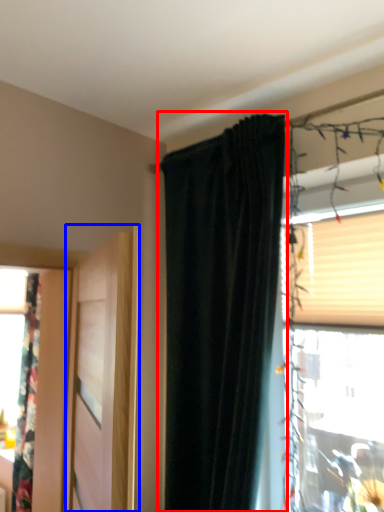
Question: Which point is closer to the camera, curtain (highlighted by a red box) or door (highlighted by a blue box)?

Choices:
 (A) curtain
 (B) door

Answer: (B)